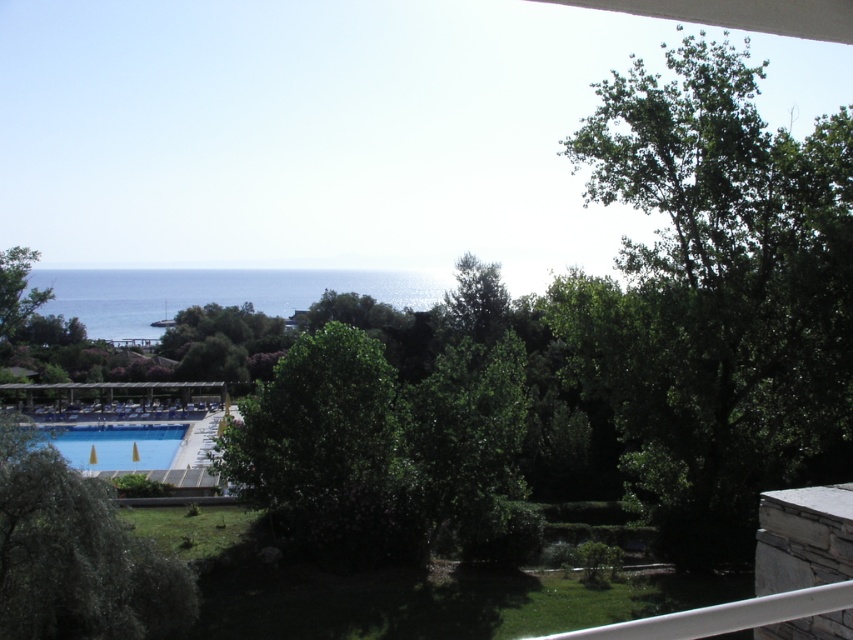
Question: Which point is closer to the camera?

Choices:
 (A) green leafy tree at upper right
 (B) green leafy tree at left

Answer: (A)

Question: Is green leafy tree at upper right smaller than green leafy tree at left?

Choices:
 (A) no
 (B) yes

Answer: (A)

Question: Is the position of green leafy tree at upper right less distant than that of green leafy tree at center?

Choices:
 (A) yes
 (B) no

Answer: (A)

Question: Which point appears closest to the camera in this image?

Choices:
 (A) (323, 371)
 (B) (15, 269)
 (C) (730, 528)

Answer: (C)

Question: Does blue glossy pool at lower left have a lesser width compared to green leafy tree at left?

Choices:
 (A) yes
 (B) no

Answer: (B)

Question: Estimate the real-world distances between objects in this image. Which object is closer to the blue glossy pool at lower left?

Choices:
 (A) green leafy tree at upper right
 (B) green leafy tree at center

Answer: (B)